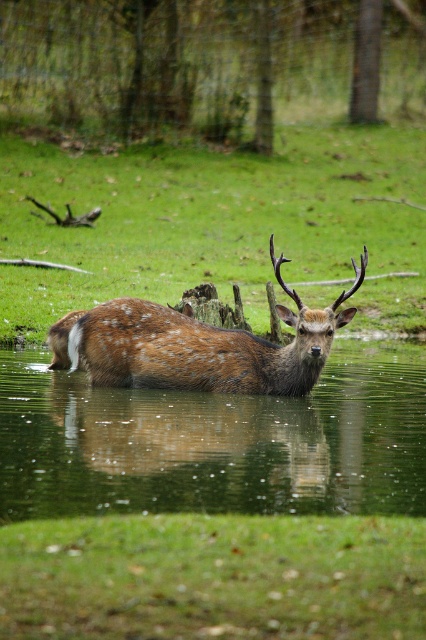
You are a photographer trying to capture the fawn fur antlered deer at center in the image. The brown textured grass at center is blocking your view. Can you move the grass to get a clear shot of the deer?

The brown textured grass at center has a larger size compared to fawn fur antlered deer at center, so the grass is bigger and might block the view. However, since the deer is at the center, you might need to adjust your angle or move closer to frame around the grass.

You are a photographer trying to capture the deer in the scene. Based on the location of the brown textured grass at center, where should you position your camera to ensure the deer is in the frame?

The brown textured grass at center is located at point [216,225]. To ensure the deer is in the frame, position your camera near this coordinate to capture the deer standing in the shallow water.